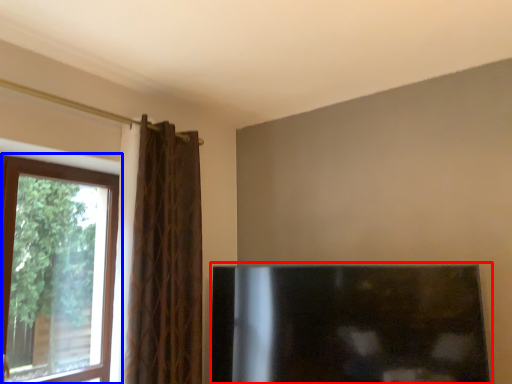
Question: Which object is closer to the camera taking this photo, fireplace (highlighted by a red box) or window (highlighted by a blue box)?

Choices:
 (A) fireplace
 (B) window

Answer: (A)